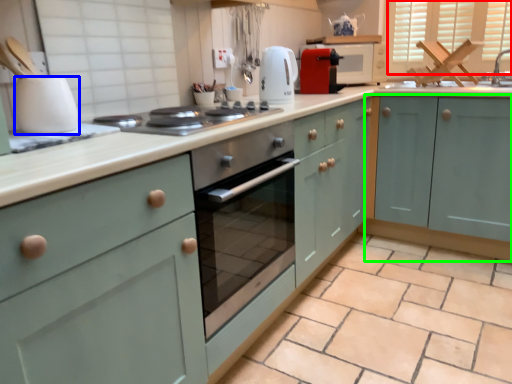
Question: Which object is positioned farthest from window (highlighted by a red box)? Select from kitchen appliance (highlighted by a blue box) and cabinetry (highlighted by a green box).

Choices:
 (A) kitchen appliance
 (B) cabinetry

Answer: (A)